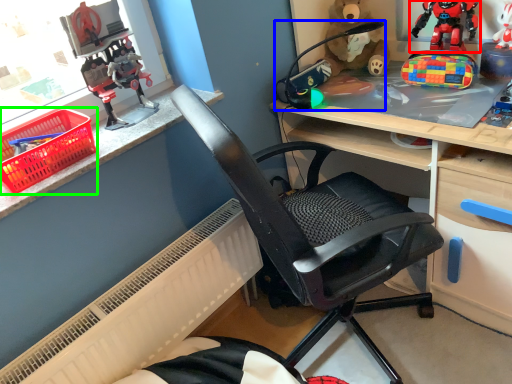
Question: Which is nearer to the toy (highlighted by a red box)? toy (highlighted by a blue box) or basket (highlighted by a green box).

Choices:
 (A) toy
 (B) basket

Answer: (A)